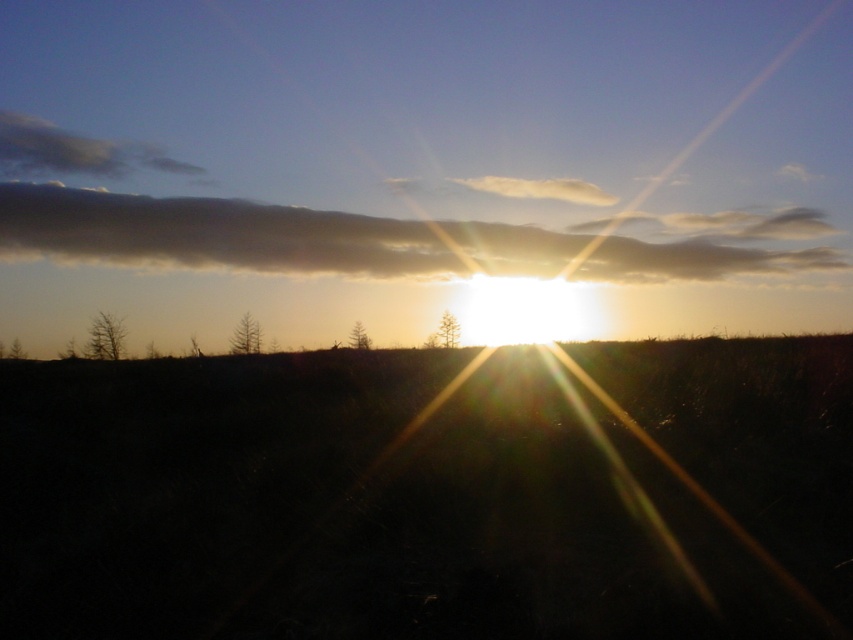
You are standing at a point in the field and want to walk towards the sun. If you start walking from point (216,253), how far will you have to walk to reach the sun?

The distance between point (216,253) and the viewer is 24.72 meters. However, the sun is a celestial body and cannot be physically reached by walking. Therefore, you cannot walk to the sun.

You are an astronomer observing the sunset and notice the dark gray cloud at upper center and the white fluffy cloud at upper left. Which cloud would appear larger to you based on their positions?

The dark gray cloud at upper center appears larger because it is closer to the viewer than the white fluffy cloud at upper left.

You are an astronomer observing the sunset and notice two white fluffy clouds in the sky. Which of the two white fluffy cloud at upper left or white fluffy cloud at upper center appears smaller in size?

The white fluffy cloud at upper left appears smaller in size compared to the white fluffy cloud at upper center.